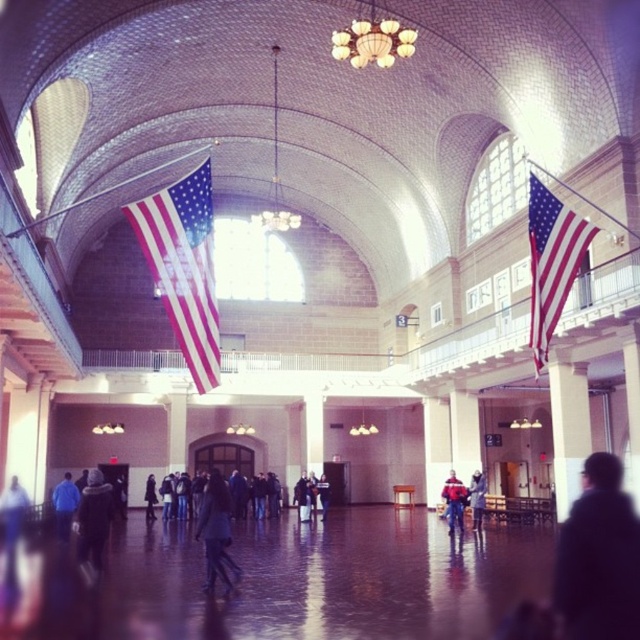
Question: Can you confirm if dark gray hoodie at lower left is bigger than dark gray sweater at center?

Choices:
 (A) yes
 (B) no

Answer: (A)

Question: Which object appears closest to the camera in this image?

Choices:
 (A) dark gray sweater at center
 (B) dark blue jacket at center

Answer: (B)

Question: Is blue fabric jacket at lower left to the left of dark gray jacket at center from the viewer's perspective?

Choices:
 (A) no
 (B) yes

Answer: (B)

Question: Among these points, which one is farthest from the camera?

Choices:
 (A) (308, 508)
 (B) (202, 534)
 (C) (474, 476)
 (D) (147, 488)

Answer: (D)

Question: Which point is farther to the camera?

Choices:
 (A) dark blue jacket at center
 (B) dark gray jacket at center

Answer: (B)

Question: Is dark gray coat at center behind dark gray jacket at center?

Choices:
 (A) yes
 (B) no

Answer: (B)